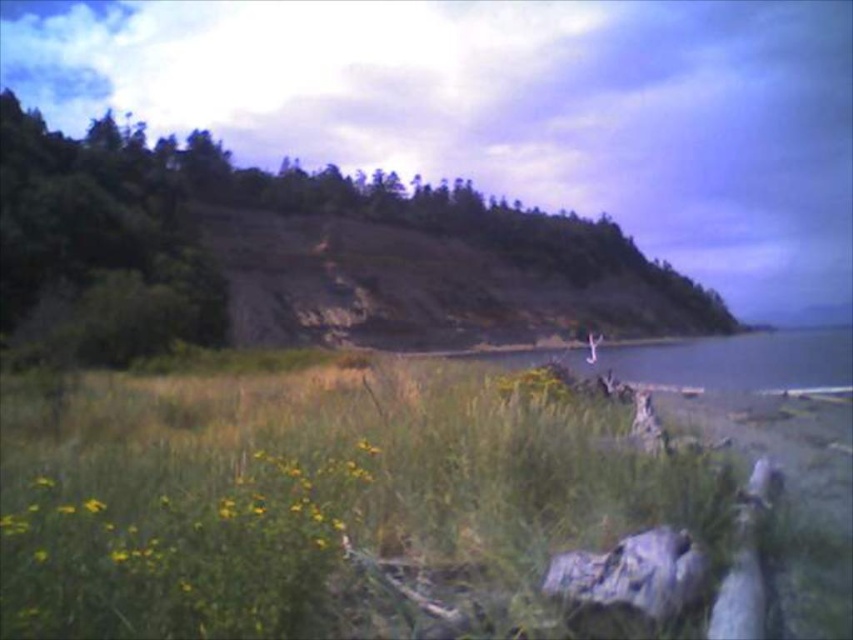
Between point (550, 576) and point (91, 509), which one is positioned behind?

The point (550, 576) is behind.

Can you confirm if gray rough rock at lower right is bigger than yellow matte flower at lower left?

Indeed, gray rough rock at lower right has a larger size compared to yellow matte flower at lower left.

The width and height of the screenshot is (853, 640). In order to click on gray rough rock at lower right in this screenshot , I will do `click(634, 573)`.

Which is more to the left, green grassy at lower center or gray rough rock at lower right?

Positioned to the left is green grassy at lower center.

Describe the element at coordinates (352, 508) in the screenshot. I see `green grassy at lower center` at that location.

Is point (184, 461) farther from viewer compared to point (669, 563)?

That is True.

The height and width of the screenshot is (640, 853). I want to click on green grassy at lower center, so click(352, 508).

Does green grassy at lower center come behind green leafy tree at upper center?

That is False.

Is green grassy at lower center wider than green leafy tree at upper center?

In fact, green grassy at lower center might be narrower than green leafy tree at upper center.

Between point (659, 616) and point (579, 248), which one is positioned behind?

The point (579, 248) is behind.

Image resolution: width=853 pixels, height=640 pixels. Find the location of `green grassy at lower center`. green grassy at lower center is located at coordinates (352, 508).